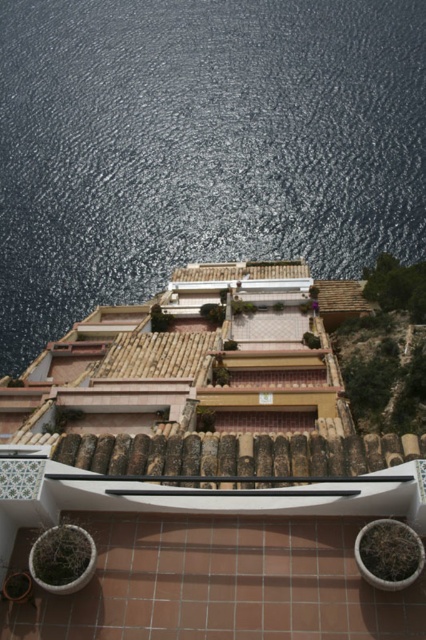
Question: Is glistening water at upper center smaller than white glossy balcony at center?

Choices:
 (A) no
 (B) yes

Answer: (A)

Question: Is glistening water at upper center thinner than white glossy balcony at center?

Choices:
 (A) yes
 (B) no

Answer: (B)

Question: Among these points, which one is nearest to the camera?

Choices:
 (A) (253, 13)
 (B) (103, 508)

Answer: (B)

Question: Among these points, which one is nearest to the camera?

Choices:
 (A) (127, 164)
 (B) (389, 506)

Answer: (B)

Question: Can you confirm if glistening water at upper center is positioned to the left of white glossy balcony at center?

Choices:
 (A) yes
 (B) no

Answer: (A)